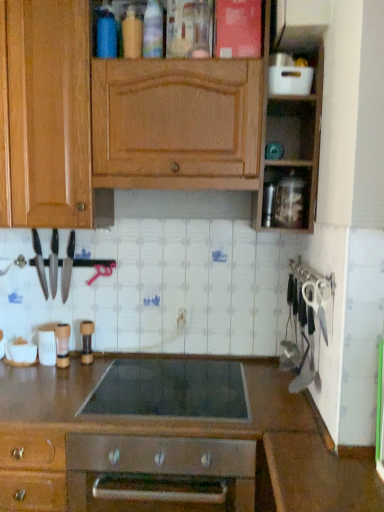
Question: Is transparent plastic container at upper right, acting as the 5th appliance starting from the left, positioned beyond the bounds of black glass cooktop at center?

Choices:
 (A) no
 (B) yes

Answer: (B)

Question: Considering the relative sizes of transparent plastic container at upper right, the second appliance viewed from the right, and black glass cooktop at center in the image provided, is transparent plastic container at upper right, the second appliance viewed from the right, wider than black glass cooktop at center?

Choices:
 (A) yes
 (B) no

Answer: (B)

Question: Considering the relative sizes of transparent plastic container at upper right, acting as the 5th appliance starting from the left, and black glass cooktop at center in the image provided, is transparent plastic container at upper right, acting as the 5th appliance starting from the left, thinner than black glass cooktop at center?

Choices:
 (A) yes
 (B) no

Answer: (A)

Question: From the image's perspective, is transparent plastic container at upper right, acting as the 5th appliance starting from the left, located above black glass cooktop at center?

Choices:
 (A) no
 (B) yes

Answer: (B)

Question: Could black glass cooktop at center be considered to be inside transparent plastic container at upper right, which appears as the fifth appliance when ordered from the bottom?

Choices:
 (A) yes
 (B) no

Answer: (B)

Question: Is transparent plastic container at upper right, acting as the 5th appliance starting from the left, taller than black glass cooktop at center?

Choices:
 (A) no
 (B) yes

Answer: (B)

Question: From a real-world perspective, is clear plastic container at lower left, the 3th appliance when ordered from left to right, positioned over black plastic knife at left, positioned as the 2th kitchen appliance in right-to-left order, based on gravity?

Choices:
 (A) yes
 (B) no

Answer: (B)

Question: Is clear plastic container at lower left, the 3th appliance when ordered from left to right, to the right of black plastic knife at left, positioned as the 2th kitchen appliance in right-to-left order, from the viewer's perspective?

Choices:
 (A) no
 (B) yes

Answer: (B)

Question: From the image's perspective, is clear plastic container at lower left, acting as the 4th appliance starting from the top, on black plastic knife at left, arranged as the second kitchen appliance when viewed from the left?

Choices:
 (A) yes
 (B) no

Answer: (B)

Question: Is clear plastic container at lower left, the third appliance when ordered from bottom to top, positioned before black plastic knife at left, arranged as the second kitchen appliance when viewed from the left?

Choices:
 (A) no
 (B) yes

Answer: (B)

Question: Considering the relative sizes of clear plastic container at lower left, which is the 4th appliance from right to left, and black plastic knife at left, positioned as the 2th kitchen appliance in right-to-left order, in the image provided, is clear plastic container at lower left, which is the 4th appliance from right to left, wider than black plastic knife at left, positioned as the 2th kitchen appliance in right-to-left order,?

Choices:
 (A) yes
 (B) no

Answer: (A)

Question: Would you say clear plastic container at lower left, the 3th appliance when ordered from left to right, contains black plastic knife at left, arranged as the second kitchen appliance when viewed from the left?

Choices:
 (A) no
 (B) yes

Answer: (A)

Question: Can you confirm if wooden cabinet at upper center is thinner than white plastic scissors at right?

Choices:
 (A) yes
 (B) no

Answer: (B)